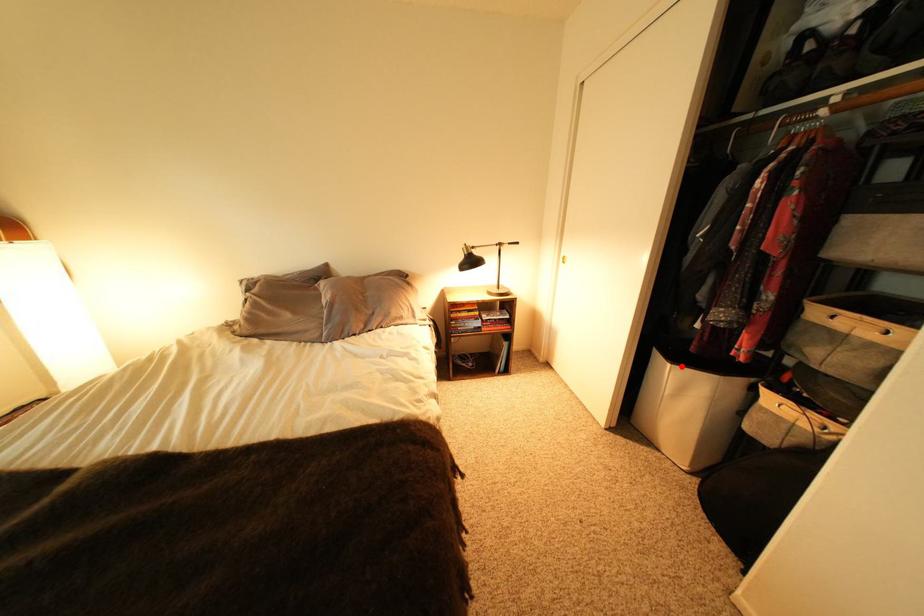
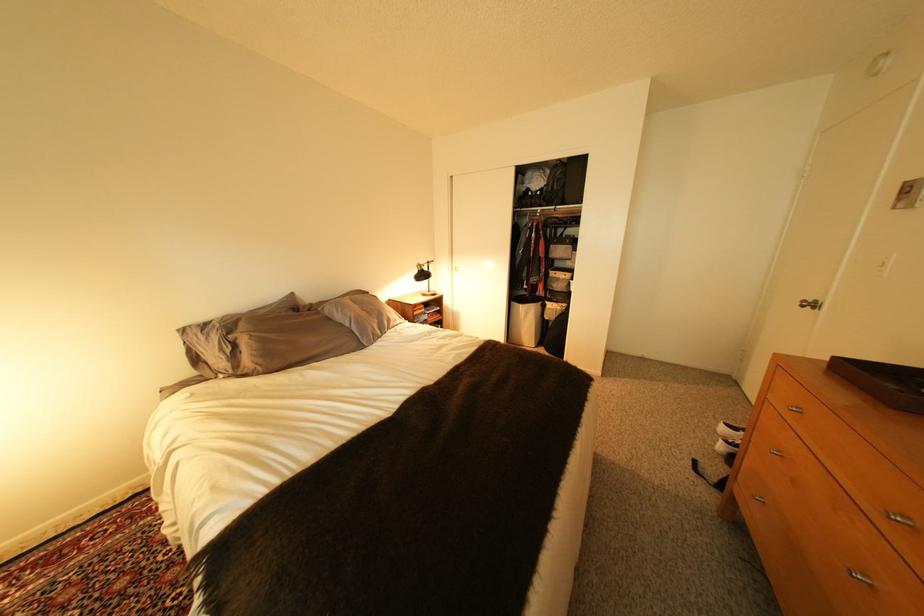
Question: I am providing you with two images of the same scene from different viewpoints. A red point is marked on the first image. At the location where the point appears in image 1, is it still visible in image 2?

Choices:
 (A) Yes
 (B) No

Answer: (A)